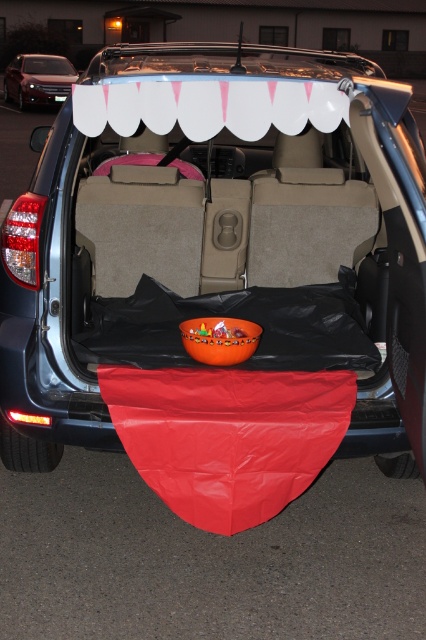
Is red matte blanket at lower center above satin silver sedan at upper left?

Incorrect, red matte blanket at lower center is not positioned above satin silver sedan at upper left.

Does red matte blanket at lower center appear under satin silver sedan at upper left?

Yes.

The height and width of the screenshot is (640, 426). In order to click on red matte blanket at lower center in this screenshot , I will do `click(227, 435)`.